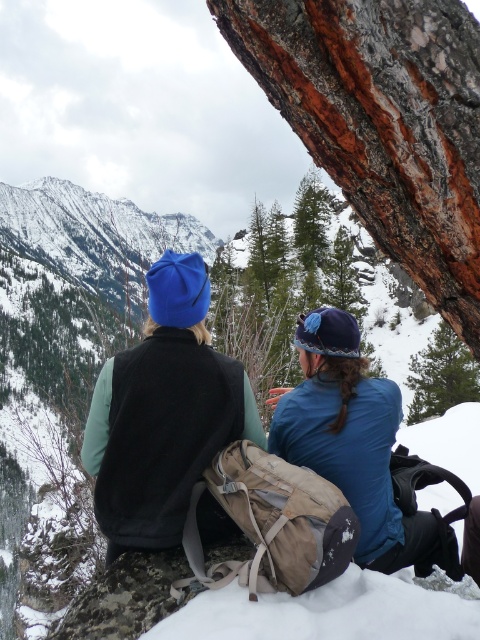
Question: Which object is the closest to the matte black vest at center?

Choices:
 (A) green textured pine tree at upper right
 (B) blue fabric hat at upper center

Answer: (B)

Question: Which object is closer to the camera taking this photo?

Choices:
 (A) blue fabric hat at upper center
 (B) matte blue beanie at upper left
 (C) green textured pine tree at upper right
 (D) matte black vest at center

Answer: (A)

Question: Is matte black vest at center further to the viewer compared to green textured pine tree at upper right?

Choices:
 (A) yes
 (B) no

Answer: (B)

Question: Among these points, which one is farthest from the camera?

Choices:
 (A) (240, 396)
 (B) (354, 556)

Answer: (A)

Question: Is matte black vest at center closer to camera compared to blue fabric hat at upper center?

Choices:
 (A) yes
 (B) no

Answer: (B)

Question: Does matte blue beanie at upper left lie behind matte black vest at center?

Choices:
 (A) no
 (B) yes

Answer: (A)